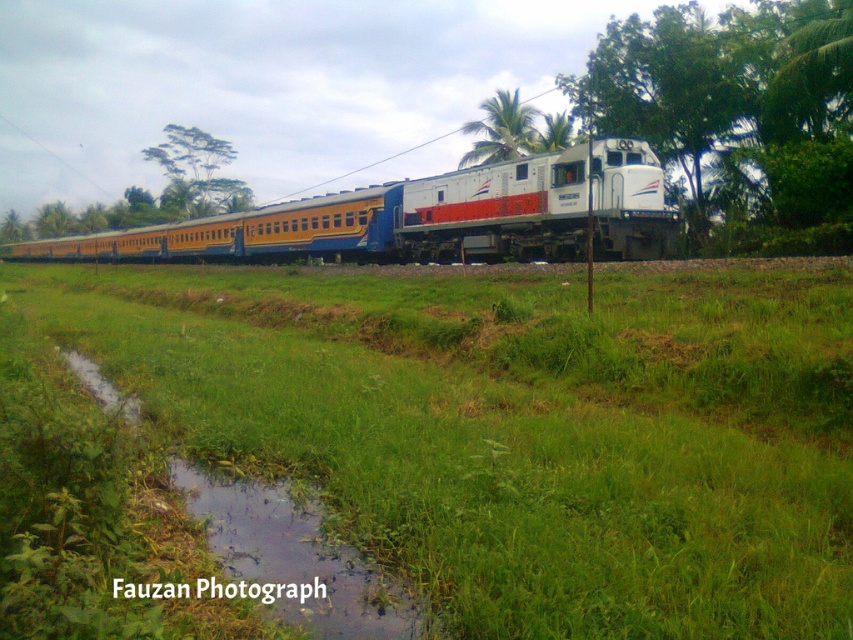
Between yellow matte train at center and green grassy puddle at lower center, which one appears on the left side from the viewer's perspective?

yellow matte train at center is more to the left.

Between point (193, 236) and point (271, 497), which one is positioned behind?

Positioned behind is point (193, 236).

I want to click on yellow matte train at center, so click(x=432, y=216).

Between point (674, 51) and point (502, 99), which one is positioned behind?

Point (502, 99)

Does green leafy tree at center appear under green leafy palm at upper center?

Incorrect, green leafy tree at center is not positioned below green leafy palm at upper center.

Between point (608, 74) and point (518, 156), which one is positioned in front?

Point (608, 74)

This screenshot has width=853, height=640. I want to click on green leafy tree at center, so click(670, 88).

In the scene shown: Does green leafy tree at center have a greater width compared to green grassy puddle at lower center?

Indeed, green leafy tree at center has a greater width compared to green grassy puddle at lower center.

Between green leafy tree at center and green grassy puddle at lower center, which one has more height?

green leafy tree at center

Image resolution: width=853 pixels, height=640 pixels. I want to click on green leafy tree at center, so click(670, 88).